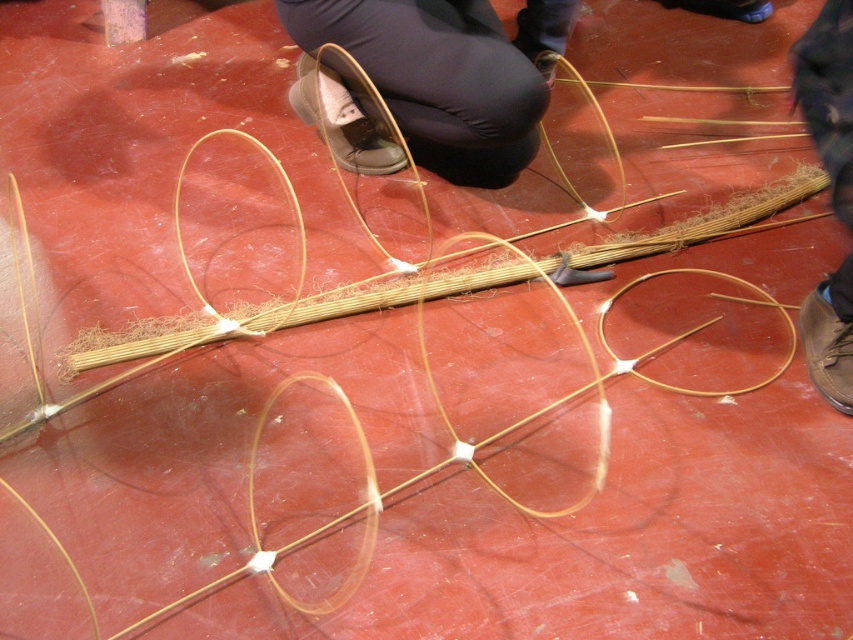
The width and height of the screenshot is (853, 640). What do you see at coordinates (447, 74) in the screenshot?
I see `brown leather shoe at center` at bounding box center [447, 74].

Measure the distance between brown leather shoe at center and camera.

The distance of brown leather shoe at center from camera is 5.67 feet.

Locate an element on the screen. brown leather shoe at center is located at coordinates (447, 74).